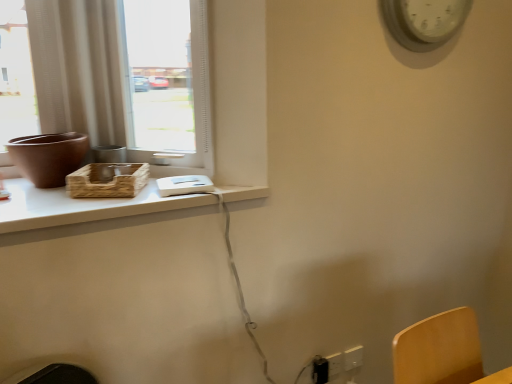
Question: Is matte brown vase at left bigger than white plastic tray at upper left?

Choices:
 (A) yes
 (B) no

Answer: (B)

Question: Considering the relative sizes of matte brown vase at left and white plastic tray at upper left in the image provided, is matte brown vase at left thinner than white plastic tray at upper left?

Choices:
 (A) no
 (B) yes

Answer: (B)

Question: Is white plastic tray at upper left at the back of matte brown vase at left?

Choices:
 (A) no
 (B) yes

Answer: (A)

Question: Does matte brown vase at left appear on the left side of white plastic tray at upper left?

Choices:
 (A) yes
 (B) no

Answer: (A)

Question: Is matte brown vase at left closer to camera compared to white plastic tray at upper left?

Choices:
 (A) no
 (B) yes

Answer: (A)

Question: From the image's perspective, is matte brown vase at left located above white plastic tray at upper left?

Choices:
 (A) yes
 (B) no

Answer: (A)

Question: Would you say black plastic electric outlet at lower right, arranged as the third electric outlet when viewed from the right, is a long distance from white plastic electric outlet at lower right, arranged as the third electric outlet when viewed from the left?

Choices:
 (A) no
 (B) yes

Answer: (A)

Question: Can you confirm if black plastic electric outlet at lower right, arranged as the first electric outlet when viewed from the left, is wider than white plastic electric outlet at lower right, arranged as the third electric outlet when viewed from the left?

Choices:
 (A) yes
 (B) no

Answer: (A)

Question: Is the depth of black plastic electric outlet at lower right, arranged as the third electric outlet when viewed from the right, greater than that of white plastic electric outlet at lower right, arranged as the third electric outlet when viewed from the left?

Choices:
 (A) yes
 (B) no

Answer: (B)

Question: Does black plastic electric outlet at lower right, arranged as the first electric outlet when viewed from the left, have a lesser width compared to white plastic electric outlet at lower right, arranged as the third electric outlet when viewed from the left?

Choices:
 (A) yes
 (B) no

Answer: (B)

Question: From a real-world perspective, is black plastic electric outlet at lower right, arranged as the first electric outlet when viewed from the left, physically above white plastic electric outlet at lower right, which ranks as the first electric outlet in right-to-left order?

Choices:
 (A) yes
 (B) no

Answer: (A)

Question: Is black plastic electric outlet at lower right, arranged as the third electric outlet when viewed from the right, positioned in front of white plastic electric outlet at lower right, which ranks as the first electric outlet in right-to-left order?

Choices:
 (A) yes
 (B) no

Answer: (A)

Question: Does matte glass window at upper left have a greater width compared to white plastic tray at upper left?

Choices:
 (A) no
 (B) yes

Answer: (A)